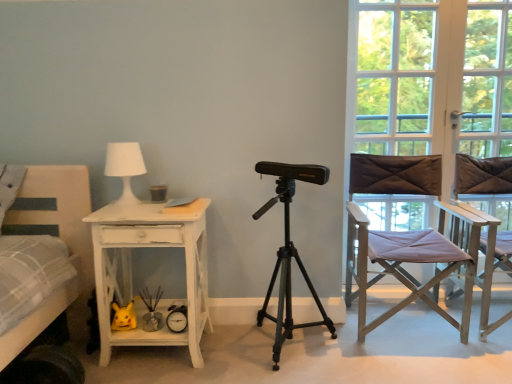
Question: Is the depth of clear glass window at right greater than that of white distressed wood desk at left?

Choices:
 (A) yes
 (B) no

Answer: (A)

Question: Does clear glass window at right have a larger size compared to white distressed wood desk at left?

Choices:
 (A) yes
 (B) no

Answer: (B)

Question: From a real-world perspective, is clear glass window at right under white distressed wood desk at left?

Choices:
 (A) no
 (B) yes

Answer: (A)

Question: Considering the relative positions of clear glass window at right and white distressed wood desk at left in the image provided, is clear glass window at right to the right of white distressed wood desk at left from the viewer's perspective?

Choices:
 (A) no
 (B) yes

Answer: (B)

Question: Is clear glass window at right far away from white distressed wood desk at left?

Choices:
 (A) no
 (B) yes

Answer: (B)

Question: Can you confirm if clear glass window at right is shorter than white distressed wood desk at left?

Choices:
 (A) yes
 (B) no

Answer: (B)

Question: From the image's perspective, is light brown fabric director's chair at right, which is the second chair in right-to-left order, under metallic tripod at center?

Choices:
 (A) no
 (B) yes

Answer: (A)

Question: Can you confirm if light brown fabric director's chair at right, the first chair from the left, is taller than metallic tripod at center?

Choices:
 (A) no
 (B) yes

Answer: (A)

Question: Is metallic tripod at center a part of light brown fabric director's chair at right, the first chair from the left?

Choices:
 (A) yes
 (B) no

Answer: (B)

Question: Is light brown fabric director's chair at right, the first chair from the left, facing away from metallic tripod at center?

Choices:
 (A) yes
 (B) no

Answer: (B)

Question: Is the depth of light brown fabric director's chair at right, the first chair from the left, less than that of metallic tripod at center?

Choices:
 (A) no
 (B) yes

Answer: (A)

Question: Is light brown fabric director's chair at right, which is the second chair in right-to-left order, wider than metallic tripod at center?

Choices:
 (A) yes
 (B) no

Answer: (A)

Question: Is white matte table lamp at upper left not inside light brown fabric director's chair at right, which is the second chair in right-to-left order?

Choices:
 (A) yes
 (B) no

Answer: (A)